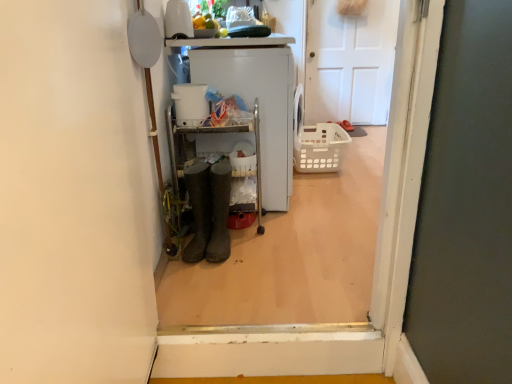
This screenshot has width=512, height=384. I want to click on free location to the right of matte rubber boots at center, so click(287, 238).